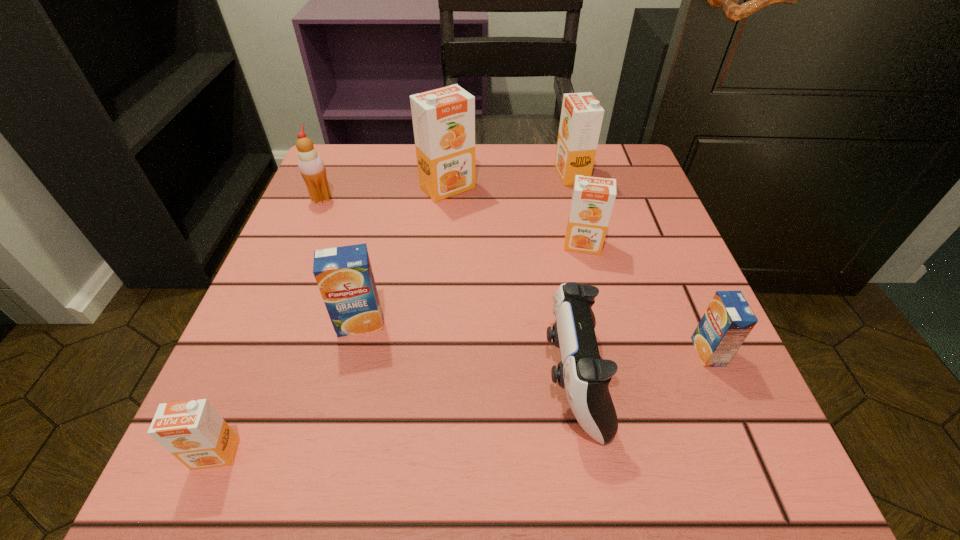
Where is `the biggest orange orange juice`? the biggest orange orange juice is located at coordinates (443, 119).

You are a GUI agent. You are given a task and a screenshot of the screen. Output one action in this format:
    pyautogui.click(x=<x>, y=<y>)
    Task: Click on the fourth orange_juice from right to left
    This screenshot has width=960, height=540.
    Given the screenshot: What is the action you would take?
    pyautogui.click(x=443, y=119)

Where is `the second tallest orange_juice`? The height and width of the screenshot is (540, 960). the second tallest orange_juice is located at coordinates (581, 119).

This screenshot has height=540, width=960. Identify the location of icecream. (311, 166).

Find the location of a particular element. the third biggest orange orange juice is located at coordinates (593, 198).

This screenshot has height=540, width=960. I want to click on the fourth farthest object, so click(593, 198).

Locate an element on the screen. the left blue orange_juice is located at coordinates (344, 275).

The height and width of the screenshot is (540, 960). Find the location of `the sixth object from right to left`. the sixth object from right to left is located at coordinates pos(344,275).

Where is `control`? Image resolution: width=960 pixels, height=540 pixels. control is located at coordinates (582, 373).

Image resolution: width=960 pixels, height=540 pixels. In order to click on the nearest orange_juice in this screenshot , I will do `click(193, 431)`.